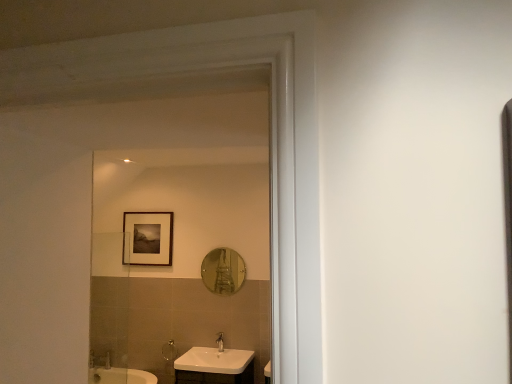
Question: In the image, is matte white shower at lower left on the left side or the right side of white glossy sink at lower center?

Choices:
 (A) left
 (B) right

Answer: (A)

Question: Is point (x=169, y=354) positioned closer to the camera than point (x=181, y=377)?

Choices:
 (A) closer
 (B) farther

Answer: (B)

Question: Based on their relative distances, which object is nearer to the matte white shower at lower left?

Choices:
 (A) silver metallic faucet at lower center
 (B) matte black picture frame at upper center
 (C) white glossy sink at lower center
 (D) shiny silver mirror at center

Answer: (A)

Question: Which is farther from the matte white shower at lower left?

Choices:
 (A) silver metallic faucet at lower center
 (B) matte black picture frame at upper center
 (C) white glossy sink at lower center
 (D) shiny silver mirror at center

Answer: (B)